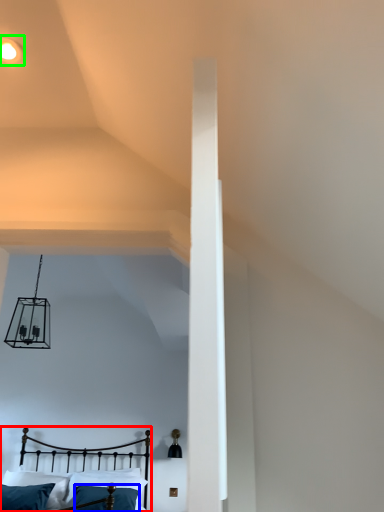
Question: Considering the real-world distances, which object is closest to bed (highlighted by a red box)? pillow (highlighted by a blue box) or light fixture (highlighted by a green box).

Choices:
 (A) pillow
 (B) light fixture

Answer: (A)